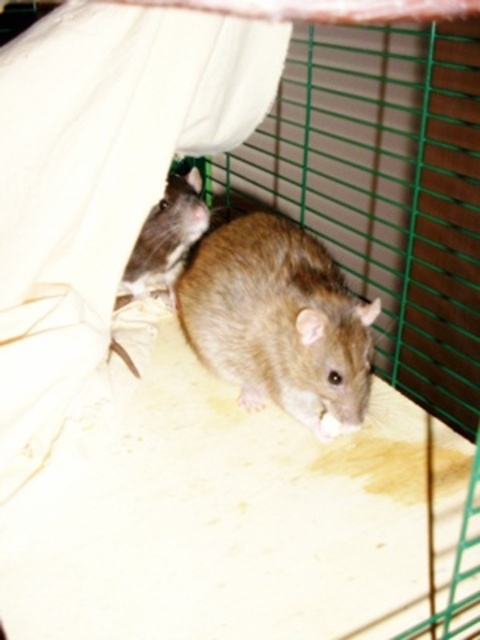
Question: Which of the following is the closest to the observer?

Choices:
 (A) (335, 408)
 (B) (166, 192)

Answer: (A)

Question: Which object is farther from the camera taking this photo?

Choices:
 (A) brown furry hamster at center
 (B) shiny brown fur at upper left

Answer: (B)

Question: Is brown furry hamster at center to the right of shiny brown fur at upper left from the viewer's perspective?

Choices:
 (A) yes
 (B) no

Answer: (A)

Question: Is brown furry hamster at center smaller than shiny brown fur at upper left?

Choices:
 (A) no
 (B) yes

Answer: (A)

Question: Can you confirm if brown furry hamster at center is smaller than shiny brown fur at upper left?

Choices:
 (A) no
 (B) yes

Answer: (A)